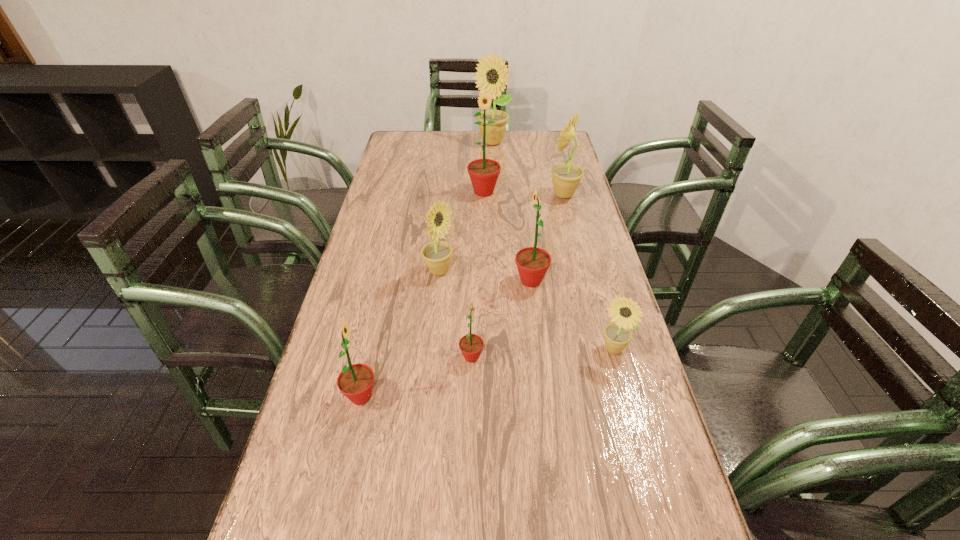
This screenshot has width=960, height=540. Identify the location of vacant region at the far right corner. (545, 150).

Find the location of a particular element. The width and height of the screenshot is (960, 540). free area in between the leftmost green sunflower and the third farthest green sunflower is located at coordinates (417, 376).

Locate an element on the screen. This screenshot has height=540, width=960. free spot between the farthest object and the second sunflower from left to right is located at coordinates (466, 207).

Where is `free area in between the smallest yellow sunflower and the third yellow sunflower from right to left`? free area in between the smallest yellow sunflower and the third yellow sunflower from right to left is located at coordinates (552, 246).

Locate an element on the screen. This screenshot has height=540, width=960. empty location between the smallest green sunflower and the second farthest green sunflower is located at coordinates (501, 319).

Identify the location of free spot between the biggest green sunflower and the second smallest yellow sunflower. The width and height of the screenshot is (960, 540). (462, 232).

The image size is (960, 540). In order to click on vacant space that is in between the farthest yellow sunflower and the third biggest green sunflower in this screenshot , I will do `click(426, 269)`.

Where is `vacant area that lies between the second farthest green sunflower and the biggest yellow sunflower`? This screenshot has height=540, width=960. vacant area that lies between the second farthest green sunflower and the biggest yellow sunflower is located at coordinates (512, 212).

The width and height of the screenshot is (960, 540). I want to click on empty space between the third farthest green sunflower and the farthest yellow sunflower, so click(x=482, y=250).

Identify the location of free point between the biggest yellow sunflower and the smallest yellow sunflower. This screenshot has height=540, width=960. (552, 246).